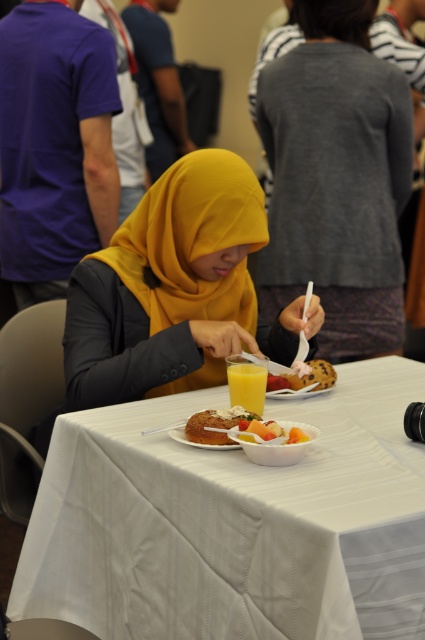
Does yellow matte hijab at center have a lesser width compared to golden brown bread at center?

No, yellow matte hijab at center is not thinner than golden brown bread at center.

Who is positioned more to the left, yellow matte hijab at center or golden brown bread at center?

From the viewer's perspective, yellow matte hijab at center appears more on the left side.

Where is `yellow matte hijab at center`? The height and width of the screenshot is (640, 425). yellow matte hijab at center is located at coordinates (175, 291).

Where is `yellow matte hijab at center`? The height and width of the screenshot is (640, 425). yellow matte hijab at center is located at coordinates (175, 291).

From the picture: Who is taller, yellow matte hijab at center or smooth chocolate cake at center?

With more height is yellow matte hijab at center.

Between yellow matte hijab at center and smooth chocolate cake at center, which one is positioned lower?

Positioned lower is smooth chocolate cake at center.

This screenshot has height=640, width=425. I want to click on yellow matte hijab at center, so click(175, 291).

Which is in front, point (214, 442) or point (258, 429)?

Positioned in front is point (258, 429).

Who is positioned more to the left, golden brown bread at center or smooth white bowl at center?

From the viewer's perspective, golden brown bread at center appears more on the left side.

Which is in front, point (198, 419) or point (263, 442)?

Positioned in front is point (263, 442).

Find the location of `golden brown bread at center`. golden brown bread at center is located at coordinates (215, 424).